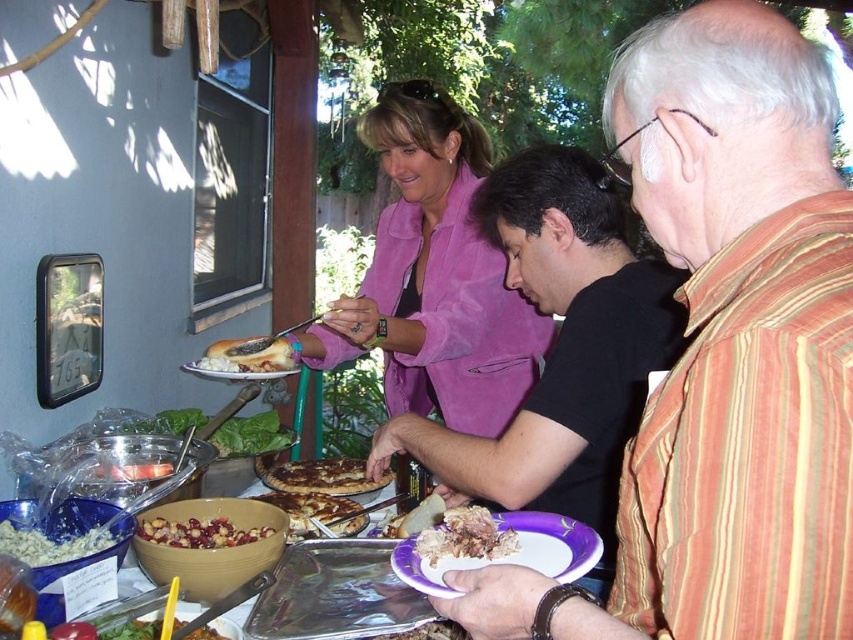
Which is behind, point (335, 460) or point (306, 531)?

Point (335, 460)

The width and height of the screenshot is (853, 640). What do you see at coordinates (325, 476) in the screenshot?
I see `chocolate glazed pastry at center` at bounding box center [325, 476].

At what (x,y) coordinates should I click in order to perform the action: click on chocolate glazed pastry at center. Please return your answer as a coordinate pair (x, y). Looking at the image, I should click on (325, 476).

Can you confirm if black matte shirt at center is taller than golden brown pancake at center?

Correct, black matte shirt at center is much taller as golden brown pancake at center.

Which of these two, black matte shirt at center or golden brown pancake at center, stands shorter?

Standing shorter between the two is golden brown pancake at center.

Is point (599, 342) more distant than point (299, 528)?

No, it is in front of (299, 528).

Locate an element on the screen. The image size is (853, 640). black matte shirt at center is located at coordinates (560, 348).

Can you confirm if chocolate glazed pastry at center is bigger than white crumbly food at lower left?

Yes, chocolate glazed pastry at center is bigger than white crumbly food at lower left.

Can you confirm if chocolate glazed pastry at center is taller than white crumbly food at lower left?

Yes.

This screenshot has width=853, height=640. What do you see at coordinates (325, 476) in the screenshot?
I see `chocolate glazed pastry at center` at bounding box center [325, 476].

Find the location of a particular element. chocolate glazed pastry at center is located at coordinates (325, 476).